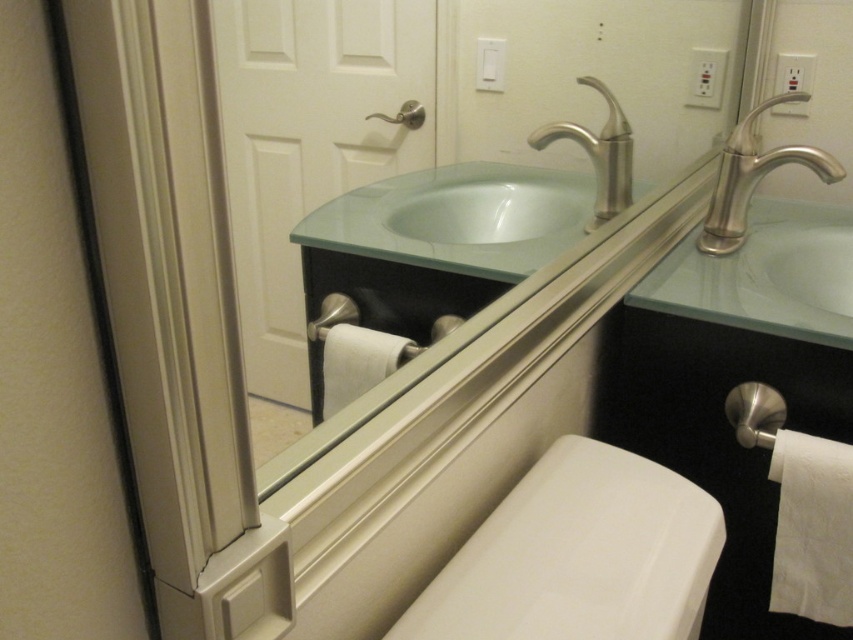
Question: Can you confirm if white glossy toilet bowl at lower center is positioned to the left of white textured toilet paper at lower right?

Choices:
 (A) yes
 (B) no

Answer: (A)

Question: Which object is closer to the camera taking this photo?

Choices:
 (A) satin nickel faucet at upper right
 (B) clear glass mirror at upper center
 (C) white glossy toilet bowl at lower center

Answer: (B)

Question: Does clear glass mirror at upper center lie behind white matte toilet paper at lower center?

Choices:
 (A) yes
 (B) no

Answer: (B)

Question: Which point appears closest to the camera in this image?

Choices:
 (A) [x=544, y=483]
 (B) [x=730, y=244]
 (C) [x=820, y=620]

Answer: (A)

Question: Estimate the real-world distances between objects in this image. Which object is closer to the brushed nickel faucet at upper center?

Choices:
 (A) white matte toilet paper at lower center
 (B) clear glass mirror at upper center
 (C) satin nickel faucet at upper right

Answer: (C)

Question: Does white glossy toilet bowl at lower center have a larger size compared to satin nickel towel bar at lower center?

Choices:
 (A) no
 (B) yes

Answer: (B)